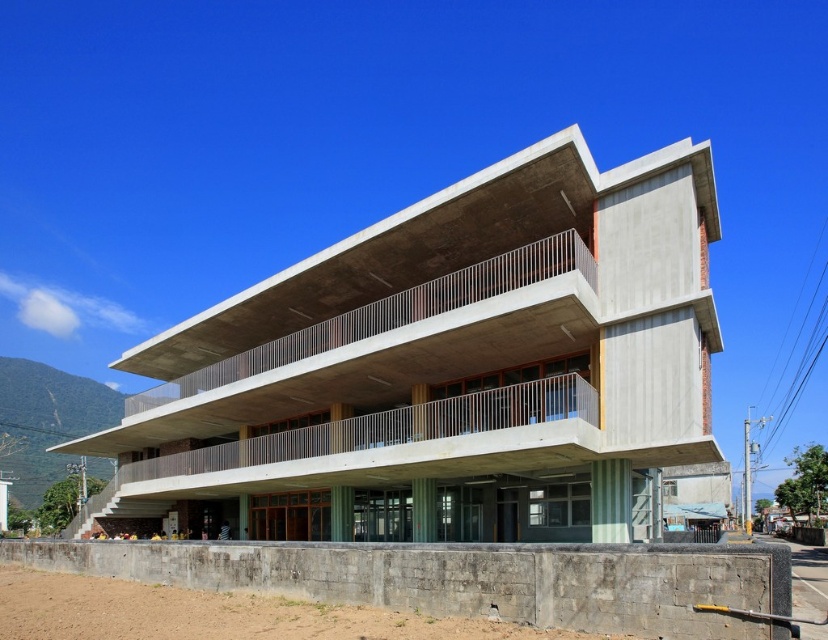
Can you confirm if concrete building at center is smaller than gray concrete wall at lower center?

No, concrete building at center is not smaller than gray concrete wall at lower center.

Between point (368, 380) and point (388, 552), which one is positioned behind?

The point (368, 380) is behind.

The height and width of the screenshot is (640, 828). What are the coordinates of `concrete building at center` in the screenshot? It's located at (445, 369).

Identify the location of concrete building at center. (445, 369).